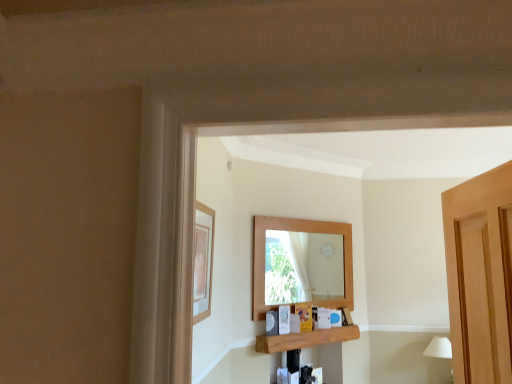
Describe the element at coordinates (439, 348) in the screenshot. The width and height of the screenshot is (512, 384). I see `white matte lampshade at lower right` at that location.

Describe the element at coordinates (203, 261) in the screenshot. The image size is (512, 384). I see `matte wooden picture frame at upper left` at that location.

Identify the location of wooden shelf at center. This screenshot has height=384, width=512. (305, 339).

Image resolution: width=512 pixels, height=384 pixels. What are the coordinates of `white matte lampshade at lower right` in the screenshot? It's located at (439, 348).

Is matte wooden picture frame at upper left looking in the opposite direction of wooden shelf at center?

No.

Who is shorter, matte wooden picture frame at upper left or wooden shelf at center?

Standing shorter between the two is wooden shelf at center.

From the image's perspective, is matte wooden picture frame at upper left located above or below wooden shelf at center?

Based on their image positions, matte wooden picture frame at upper left is located above wooden shelf at center.

Does white matte lampshade at lower right have a larger size compared to wooden shelf at center?

Correct, white matte lampshade at lower right is larger in size than wooden shelf at center.

Does white matte lampshade at lower right come behind wooden shelf at center?

Yes, white matte lampshade at lower right is further from the viewer.

Is white matte lampshade at lower right facing towards wooden shelf at center?

No.

How many degrees apart are the facing directions of white matte lampshade at lower right and wooden shelf at center?

44.6 degrees separate the facing orientations of white matte lampshade at lower right and wooden shelf at center.

Is white matte lampshade at lower right touching matte wooden picture frame at upper left?

No, white matte lampshade at lower right is not with matte wooden picture frame at upper left.

This screenshot has width=512, height=384. I want to click on lamp on the right of matte wooden picture frame at upper left, so click(439, 348).

From a real-world perspective, which object rests below the other?

white matte lampshade at lower right, from a real-world perspective.

Considering the sizes of white matte lampshade at lower right and matte wooden picture frame at upper left in the image, is white matte lampshade at lower right bigger or smaller than matte wooden picture frame at upper left?

Clearly, white matte lampshade at lower right is larger in size than matte wooden picture frame at upper left.

Considering the points (271, 349) and (197, 235), which point is behind, point (271, 349) or point (197, 235)?

The point (271, 349) is farther.

Which object is further away from the camera taking this photo, wooden shelf at center or matte wooden picture frame at upper left?

wooden shelf at center is more distant.

Measure the distance between wooden shelf at center and matte wooden picture frame at upper left.

They are 1.39 meters apart.

Does wooden shelf at center have a lesser width compared to matte wooden picture frame at upper left?

In fact, wooden shelf at center might be wider than matte wooden picture frame at upper left.

Which is more to the right, wooden shelf at center or white matte lampshade at lower right?

white matte lampshade at lower right.

Which of these two, wooden shelf at center or white matte lampshade at lower right, is bigger?

white matte lampshade at lower right.

Where is `shelf on the left of white matte lampshade at lower right`? The width and height of the screenshot is (512, 384). shelf on the left of white matte lampshade at lower right is located at coordinates (305, 339).

Is wooden shelf at center not close to white matte lampshade at lower right?

That's right, there is a large distance between wooden shelf at center and white matte lampshade at lower right.

Considering the relative sizes of matte wooden picture frame at upper left and white matte lampshade at lower right in the image provided, is matte wooden picture frame at upper left bigger than white matte lampshade at lower right?

No, matte wooden picture frame at upper left is not bigger than white matte lampshade at lower right.

Looking at their sizes, would you say matte wooden picture frame at upper left is wider or thinner than white matte lampshade at lower right?

matte wooden picture frame at upper left is thinner than white matte lampshade at lower right.

Based on the photo, from a real-world perspective, who is located lower, matte wooden picture frame at upper left or white matte lampshade at lower right?

white matte lampshade at lower right, from a real-world perspective.

The image size is (512, 384). I want to click on picture frame located above the wooden shelf at center (from the image's perspective), so click(203, 261).

At what (x,y) coordinates should I click in order to perform the action: click on lamp directly beneath the wooden shelf at center (from a real-world perspective). Please return your answer as a coordinate pair (x, y). Looking at the image, I should click on (439, 348).

Considering their positions, is matte wooden picture frame at upper left positioned closer to wooden shelf at center than white matte lampshade at lower right?

white matte lampshade at lower right.

Based on their spatial positions, is white matte lampshade at lower right or matte wooden picture frame at upper left further from wooden shelf at center?

Based on the image, matte wooden picture frame at upper left appears to be further to wooden shelf at center.

When comparing their distances from matte wooden picture frame at upper left, does wooden shelf at center or white matte lampshade at lower right seem further?

white matte lampshade at lower right is positioned further to the anchor matte wooden picture frame at upper left.

Based on their spatial positions, is wooden shelf at center or matte wooden picture frame at upper left further from white matte lampshade at lower right?

Based on the image, matte wooden picture frame at upper left appears to be further to white matte lampshade at lower right.

Considering their positions, is white matte lampshade at lower right positioned further to matte wooden picture frame at upper left than wooden shelf at center?

Among the two, white matte lampshade at lower right is located further to matte wooden picture frame at upper left.

Looking at this image, looking at the image, which one is located further to white matte lampshade at lower right, matte wooden picture frame at upper left or wooden shelf at center?

matte wooden picture frame at upper left is positioned further to the anchor white matte lampshade at lower right.

This screenshot has height=384, width=512. In order to click on shelf located between matte wooden picture frame at upper left and white matte lampshade at lower right in the left-right direction in this screenshot , I will do `click(305, 339)`.